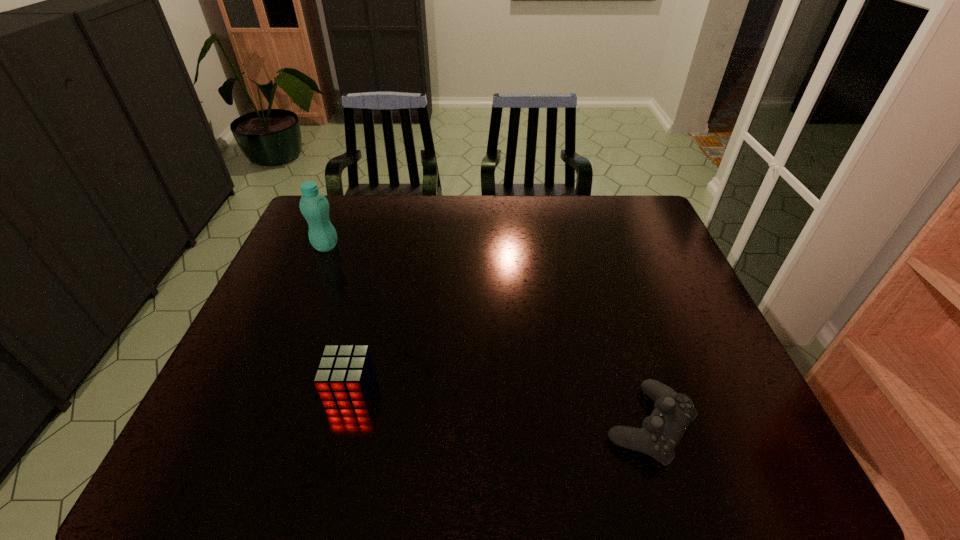
The width and height of the screenshot is (960, 540). I want to click on free space that satisfies the following two spatial constraints: 1. on the front side of the leftmost object; 2. on the left side of the control, so click(251, 425).

Identify the location of free point that satisfies the following two spatial constraints: 1. on the front side of the shortest object; 2. on the left side of the second object from right to left. (342, 425).

Where is `vacant region that satisfies the following two spatial constraints: 1. on the front side of the second object from left to right; 2. on the left side of the rightmost object`? This screenshot has height=540, width=960. vacant region that satisfies the following two spatial constraints: 1. on the front side of the second object from left to right; 2. on the left side of the rightmost object is located at coordinates (342, 425).